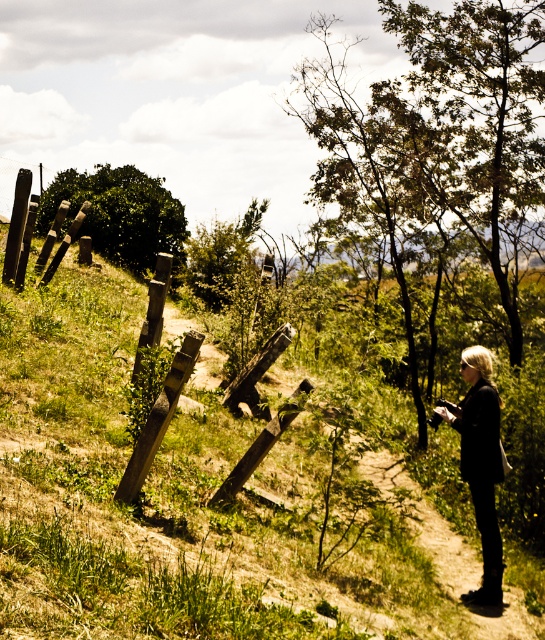
You are an outdoor photographer setting up a shot of the green leafy tree at upper left and the black leather jacket at lower right. Which object will appear bigger in your photo?

The green leafy tree at upper left will appear bigger in the photo because it is larger in size than the black leather jacket at lower right.

You are planning to plant a new tree in this area. Given the space between the green leafy tree at right and the green leafy tree at upper left, which tree would be a better choice for planting a smaller sapling next to?

The green leafy tree at upper left would be a better choice for planting a smaller sapling next to because its width is smaller than the green leafy tree at right, allowing more space for the sapling to grow without overcrowding.

You are standing at the center of the grassy hill and want to reach the green leafy tree at upper left. Which direction should you move in to get there?

You should move towards the upper left direction to reach the green leafy tree at upper left since it is located at point (119, 214).